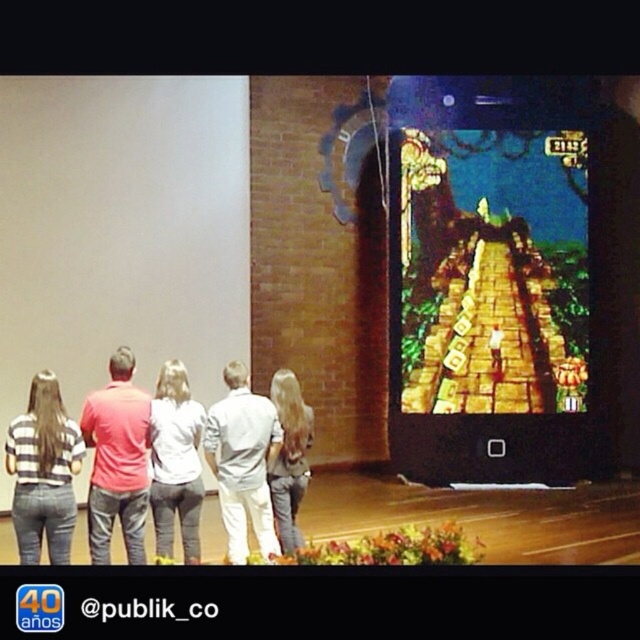
Question: Which object is farther from the camera taking this photo?

Choices:
 (A) white cotton shirt at center
 (B) striped shirt at left
 (C) red shirt at left

Answer: (A)

Question: Which point is farther to the camera?

Choices:
 (A) striped shirt at left
 (B) white matte shirt at center

Answer: (B)

Question: Can you confirm if golden stone staircase at center is smaller than striped shirt at left?

Choices:
 (A) no
 (B) yes

Answer: (A)

Question: Can you confirm if red shirt at left is smaller than white matte shirt at center?

Choices:
 (A) no
 (B) yes

Answer: (A)

Question: Does red shirt at left appear under denim jeans at center?

Choices:
 (A) no
 (B) yes

Answer: (A)

Question: Among these objects, which one is nearest to the camera?

Choices:
 (A) golden stone staircase at center
 (B) striped shirt at left
 (C) red shirt at left

Answer: (B)